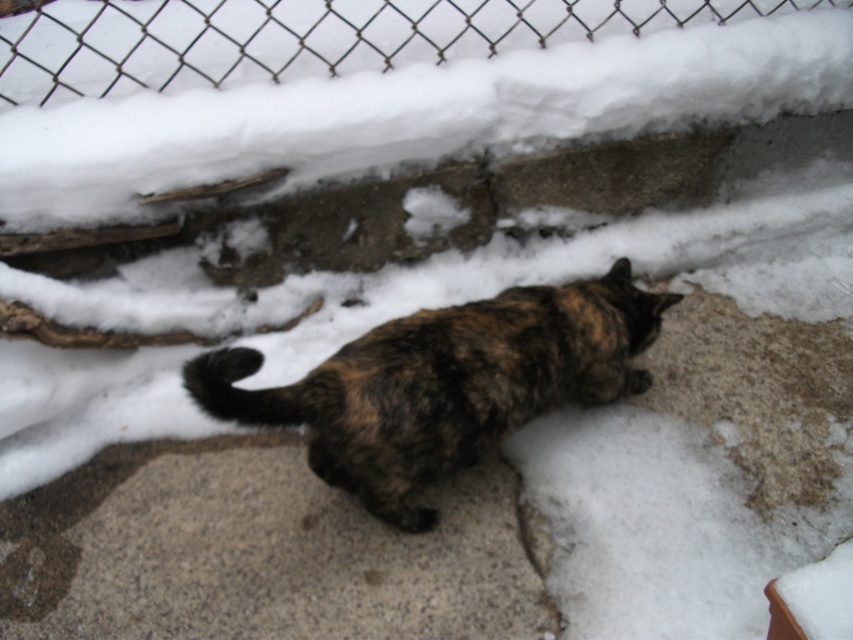
Question: Can you confirm if brown fur cat at center is smaller than wire mesh fence at upper center?

Choices:
 (A) no
 (B) yes

Answer: (B)

Question: Among these objects, which one is farthest from the camera?

Choices:
 (A) brown fur cat at center
 (B) wire mesh fence at upper center

Answer: (B)

Question: In this image, where is brown fur cat at center located relative to wire mesh fence at upper center?

Choices:
 (A) right
 (B) left

Answer: (A)

Question: Does brown fur cat at center appear on the right side of wire mesh fence at upper center?

Choices:
 (A) no
 (B) yes

Answer: (B)